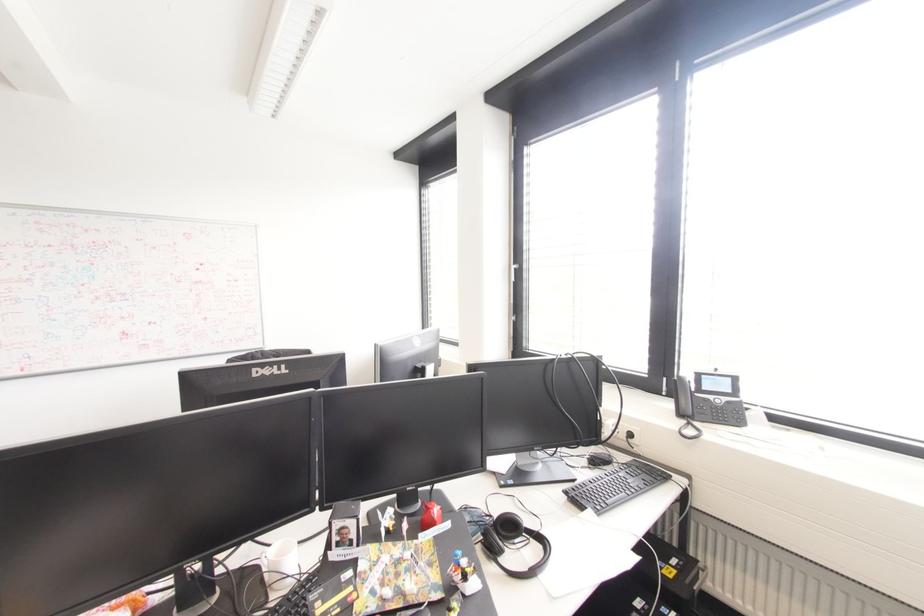
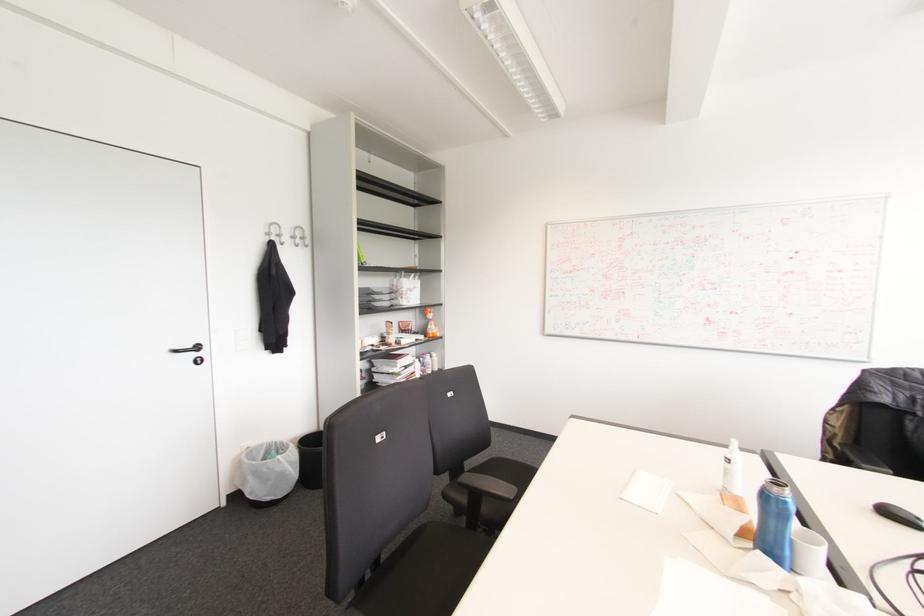
Question: How did the camera likely rotate?

Choices:
 (A) Left
 (B) Right
 (C) Up
 (D) Down

Answer: (A)